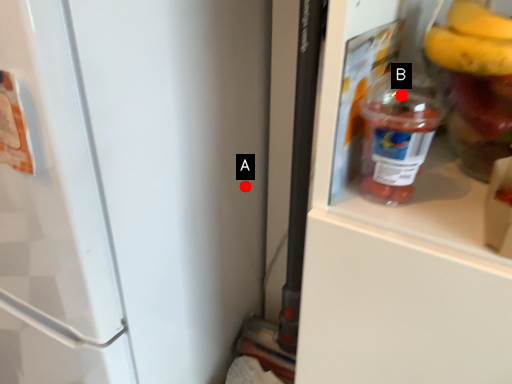
Question: Two points are circled on the image, labeled by A and B beside each circle. Which point appears closest to the camera in this image?

Choices:
 (A) A is closer
 (B) B is closer

Answer: (B)